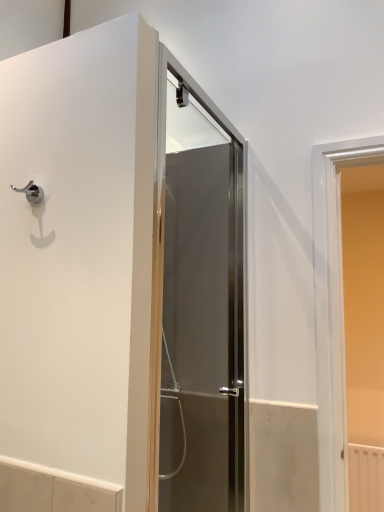
What do you see at coordinates (201, 316) in the screenshot? I see `polished stainless steel shower door at center` at bounding box center [201, 316].

The width and height of the screenshot is (384, 512). I want to click on polished stainless steel shower door at center, so click(x=201, y=316).

In order to face polished stainless steel shower door at center, should I rotate leftwards or rightwards?

To align with it, rotate right about 1.269°.

Find the location of a particular element. polished stainless steel shower door at center is located at coordinates (201, 316).